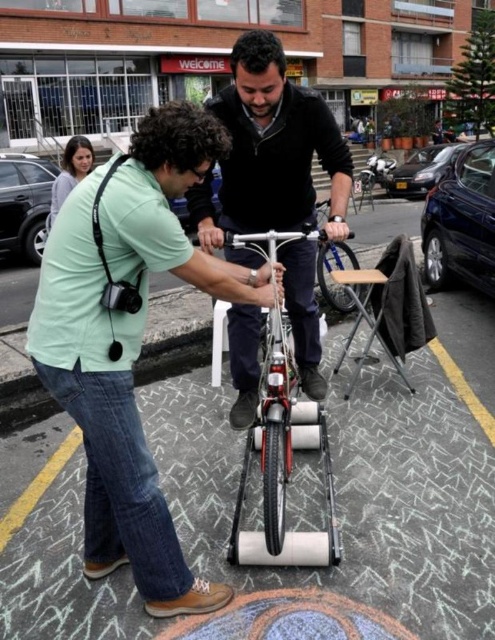
In the scene shown: Based on the scene description, what is located at the coordinates point (347, 488)?

The white textured pavement at center is located at point (347, 488).

You are standing in a public plaza and see the white textured pavement at center and the shiny blue bicycle at center. Which object is located to the left of the other?

The white textured pavement at center is positioned on the left side of the shiny blue bicycle at center.

You are a delivery person who needs to place a package on the ground between the white textured pavement at center and the shiny blue bicycle at center. The package requires 10 feet of space. Is there enough space between them?

The distance between the white textured pavement at center and the shiny blue bicycle at center is 11.27 feet, which is more than the required 10 feet. Therefore, there is enough space to place the package between them.